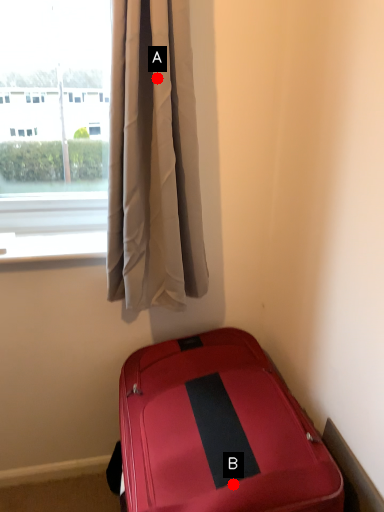
Question: Two points are circled on the image, labeled by A and B beside each circle. Which point is closer to the camera?

Choices:
 (A) A is closer
 (B) B is closer

Answer: (B)